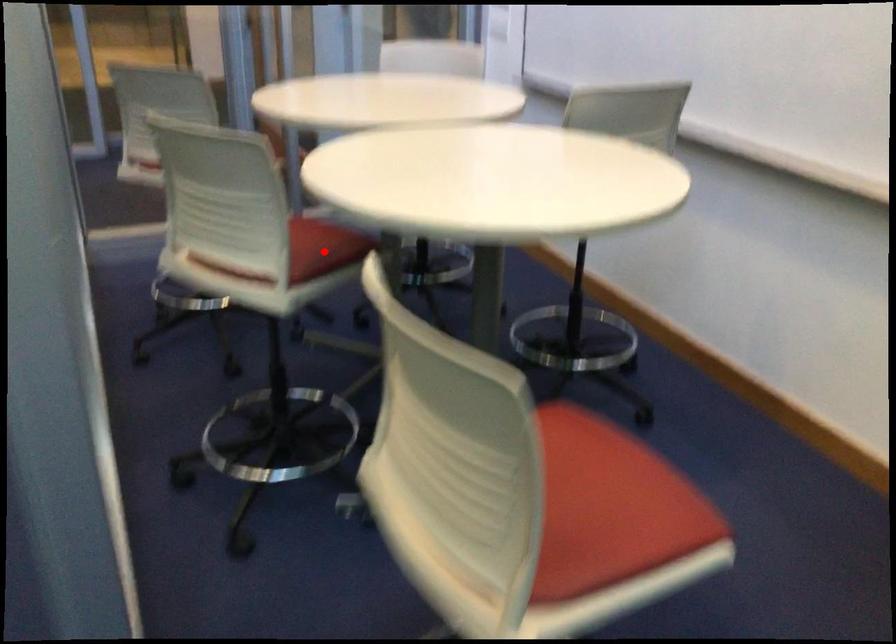
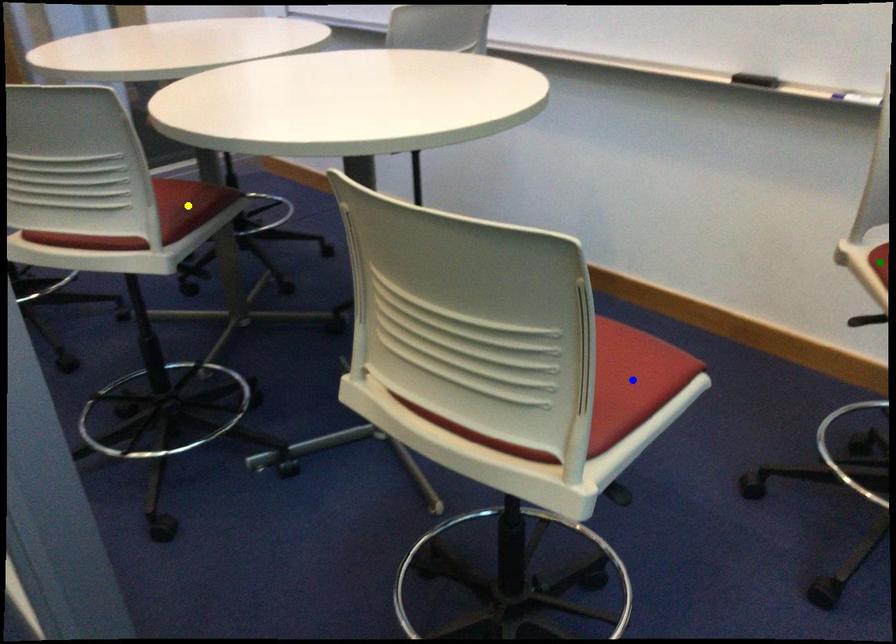
Question: I am providing you with two images of the same scene from different viewpoints. A red point is marked on the first image. You are given multiple points on the second image. Which point in image 2 represents the same 3d spot as the red point in image 1?

Choices:
 (A) yellow point
 (B) blue point
 (C) green point

Answer: (A)